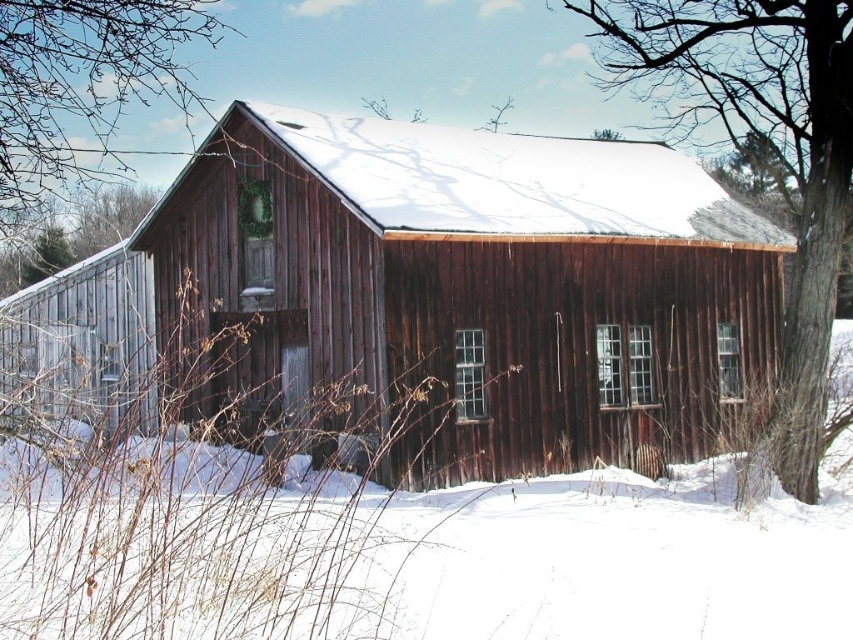
You are an architect analyzing the layout of the rustic wood cabin at center and the brown wood tree at upper left in the image. Which object takes up more area in the image?

The brown wood tree at upper left occupies more space in the image than the rustic wood cabin at center.

You are an artist sketching the barn and its surroundings. You want to draw the smooth bark tree at right and the brown wood tree at upper left. Which tree should you draw with a thinner trunk?

The smooth bark tree at right is thinner than the brown wood tree at upper left, so you should draw the smooth bark tree at right with a thinner trunk.